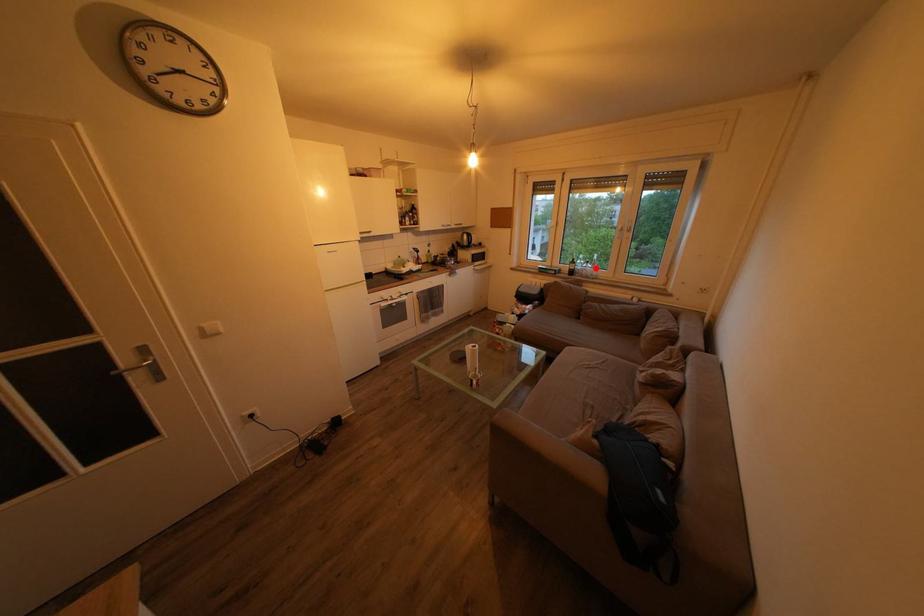
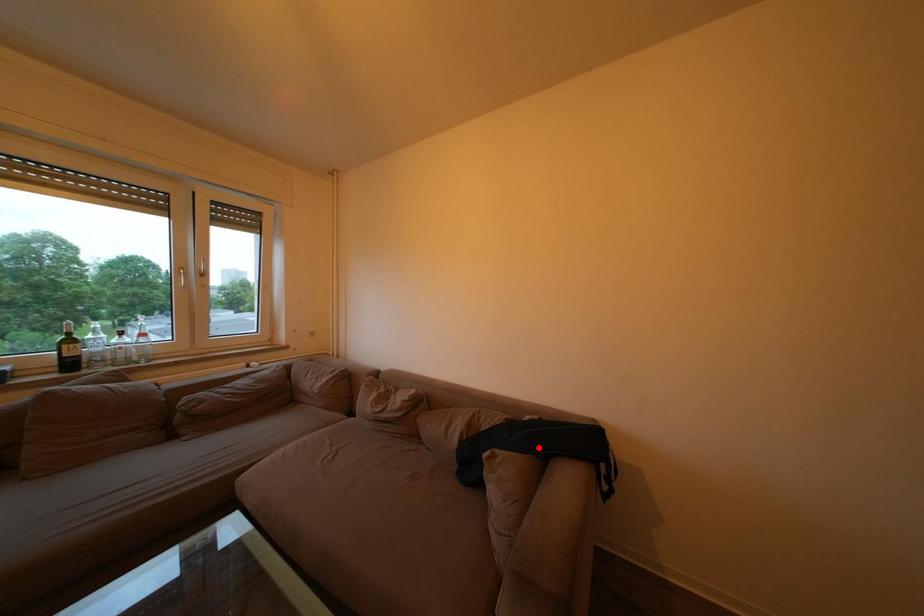
I am providing you with two images of the same scene from different viewpoints. A red point is marked on the first image and another point is marked on the second image. Does the point marked in image1 correspond to the same location as the one in image2?

No